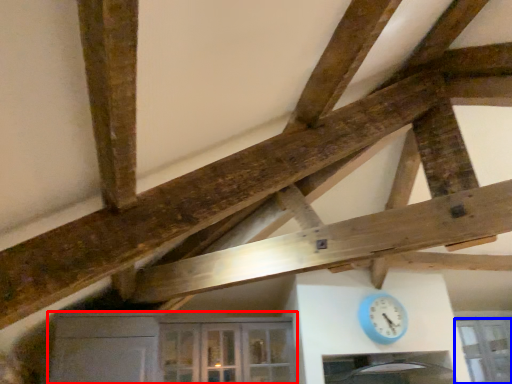
Question: Which of the following is the farthest to the observer, cabinetry (highlighted by a red box) or window (highlighted by a blue box)?

Choices:
 (A) cabinetry
 (B) window

Answer: (B)